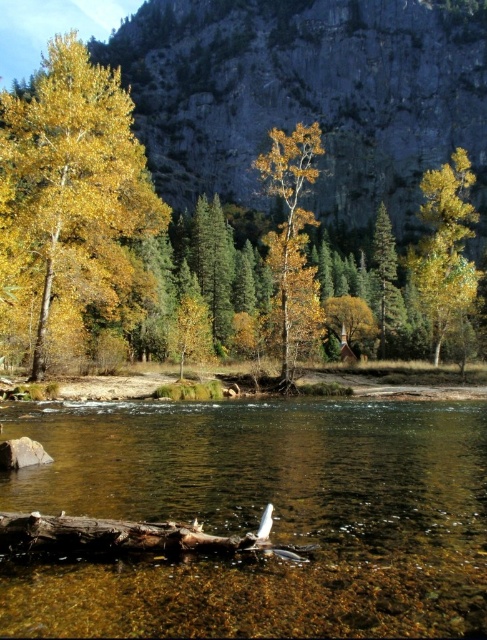
You are standing at the point with coordinates [293,237] in the image. What do you see there?

At point [293,237], there are golden yellow leaves at center.

You are a hiker standing at the edge of the river and see the yellow matte tree at right and the brown rough log at lower center. Which object is taller?

The yellow matte tree at right is taller than the brown rough log at lower center.

You are standing at the riverside and see the golden yellow leaves at center and the brown rough log at lower center. Which object is closer to the water surface?

The golden yellow leaves at center are closer to the water surface because they are positioned over the brown rough log at lower center.